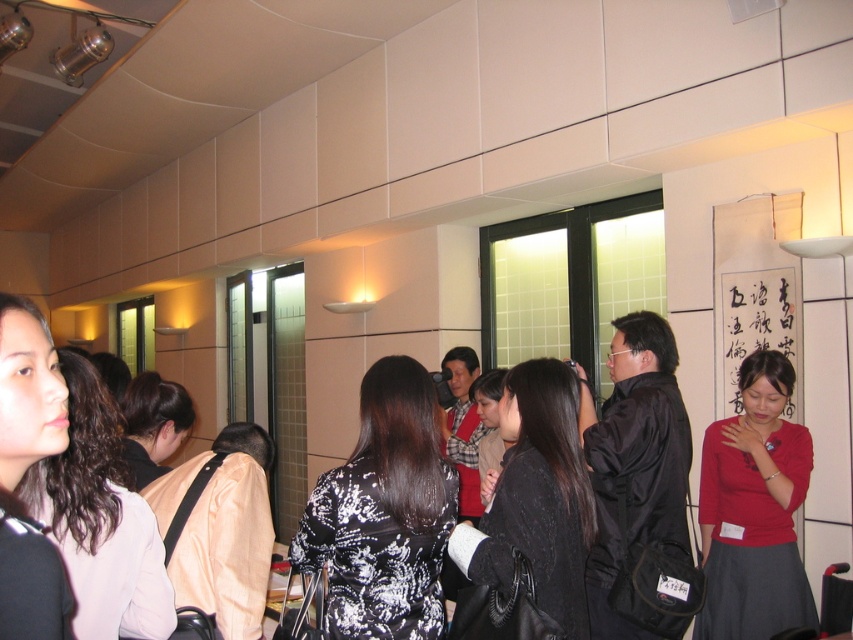
Question: Does light pink fabric at center appear under black textured hair at center?

Choices:
 (A) no
 (B) yes

Answer: (A)

Question: Is red matte dress at lower right to the right of black textured hair at center from the viewer's perspective?

Choices:
 (A) no
 (B) yes

Answer: (B)

Question: Does red matte dress at lower right have a smaller size compared to black textured hair at center?

Choices:
 (A) no
 (B) yes

Answer: (A)

Question: Estimate the real-world distances between objects in this image. Which object is closer to the black matte hair at left?

Choices:
 (A) black printed dress at center
 (B) black textured sweater at center
 (C) black textured hair at center

Answer: (A)

Question: Which object is positioned farthest from the red matte dress at lower right?

Choices:
 (A) black textured hair at center
 (B) black textured sweater at center

Answer: (A)

Question: Considering the real-world distances, which object is farthest from the red matte dress at lower right?

Choices:
 (A) light pink fabric at center
 (B) black printed dress at center

Answer: (A)